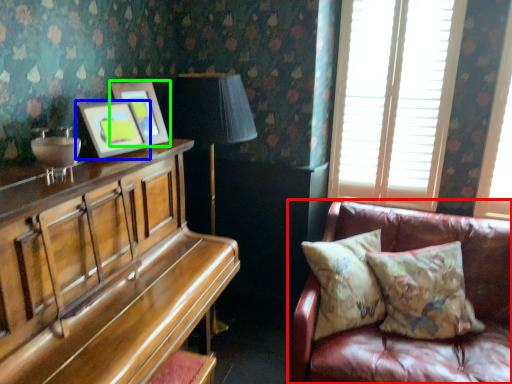
Question: Which object is positioned farthest from studio couch (highlighted by a red box)? Select from picture frame (highlighted by a blue box) and picture frame (highlighted by a green box).

Choices:
 (A) picture frame
 (B) picture frame

Answer: (A)